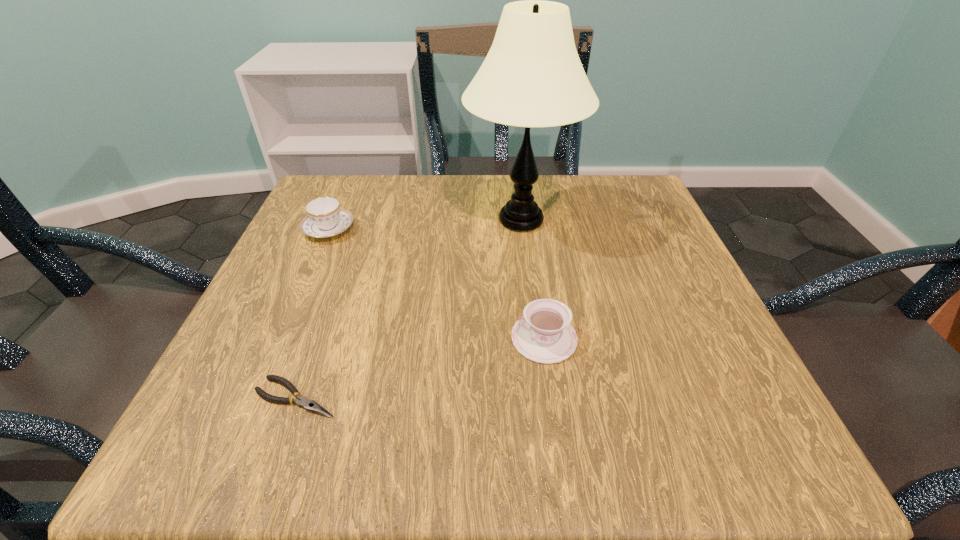
The height and width of the screenshot is (540, 960). Identify the location of free spot between the pliers and the right teacup. (420, 368).

The width and height of the screenshot is (960, 540). What are the coordinates of `free area in between the right teacup and the farther teacup` in the screenshot? It's located at (436, 284).

The height and width of the screenshot is (540, 960). I want to click on free space between the right teacup and the shortest object, so click(x=420, y=368).

The height and width of the screenshot is (540, 960). What are the coordinates of `vacant area that lies between the right teacup and the lamp` in the screenshot? It's located at (533, 279).

The height and width of the screenshot is (540, 960). Find the location of `free point between the right teacup and the lamp`. free point between the right teacup and the lamp is located at coordinates (533, 279).

Identify the location of unoccupied position between the tallest object and the pliers. This screenshot has height=540, width=960. (409, 309).

Locate an element on the screen. This screenshot has height=540, width=960. vacant space that's between the right teacup and the lamp is located at coordinates (533, 279).

Locate which object is the closest to the third farthest object. Please provide its 2D coordinates. Your answer should be formatted as a tuple, i.e. [(x, y)], where the tuple contains the x and y coordinates of a point satisfying the conditions above.

[(532, 76)]

Point out which object is positioned as the second nearest to the second nearest object. Please provide its 2D coordinates. Your answer should be formatted as a tuple, i.e. [(x, y)], where the tuple contains the x and y coordinates of a point satisfying the conditions above.

[(309, 405)]

Locate an element on the screen. The height and width of the screenshot is (540, 960). free location that satisfies the following two spatial constraints: 1. on the handle side of the nearer teacup; 2. on the front side of the nearest object is located at coordinates (552, 397).